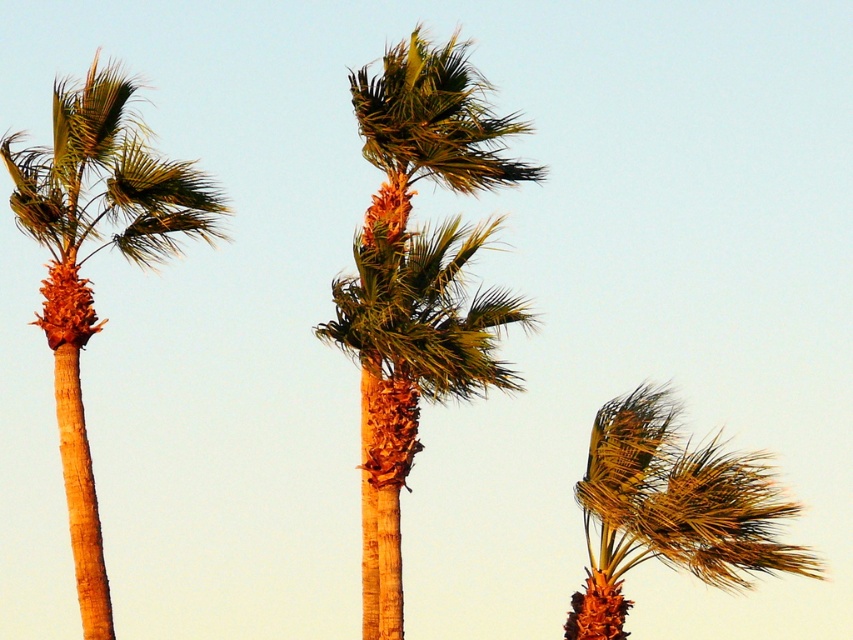
Is green leafy palm tree at left smaller than golden textured palm tree at center?

No, green leafy palm tree at left is not smaller than golden textured palm tree at center.

From the picture: Which is more to the left, green leafy palm tree at left or golden textured palm tree at center?

Positioned to the left is green leafy palm tree at left.

The width and height of the screenshot is (853, 640). Find the location of `green leafy palm tree at left`. green leafy palm tree at left is located at coordinates (90, 256).

Locate an element on the screen. green leafy palm tree at left is located at coordinates (90, 256).

Is point (386, 288) positioned before point (757, 561)?

Yes, point (386, 288) is closer to viewer.

Who is more distant from viewer, (480,316) or (698,531)?

The point (480,316) is more distant.

Does point (393, 374) come in front of point (698, 483)?

No, it is behind (698, 483).

The height and width of the screenshot is (640, 853). Identify the location of green leafy palm tree at center. (416, 282).

Who is more forward, (416, 166) or (91, 88)?

Point (91, 88)

Which is more to the left, green leafy palm tree at center or green leafy palm tree at left?

Positioned to the left is green leafy palm tree at left.

Locate an element on the screen. The width and height of the screenshot is (853, 640). green leafy palm tree at center is located at coordinates (416, 282).